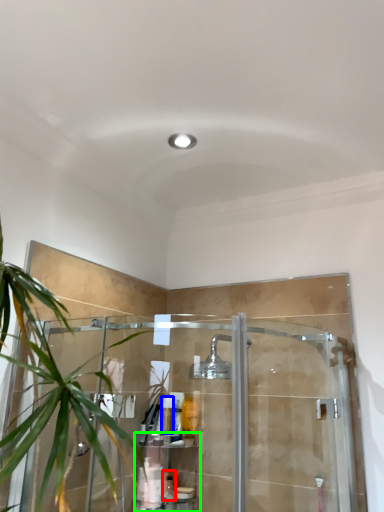
Question: Based on their relative distances, which object is nearer to toiletry (highlighted by a red box)? Choose from toiletry (highlighted by a blue box) and shelf (highlighted by a green box).

Choices:
 (A) toiletry
 (B) shelf

Answer: (B)